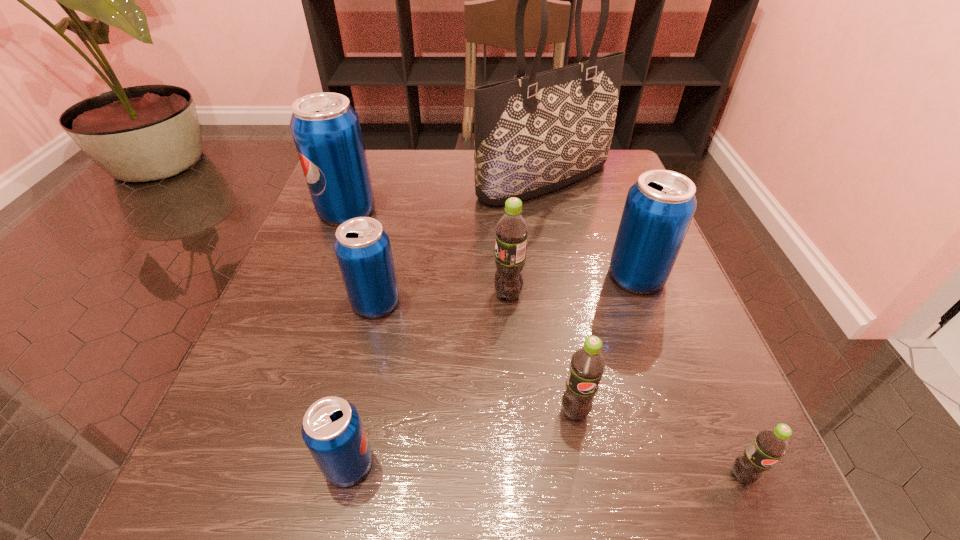
What are the coordinates of `tote bag` in the screenshot? It's located at (534, 134).

Locate an element on the screen. The height and width of the screenshot is (540, 960). black tote bag is located at coordinates (534, 134).

This screenshot has height=540, width=960. Find the location of `the leftmost object`. the leftmost object is located at coordinates (326, 130).

Find the location of a particular element. the biggest blue pop soda is located at coordinates (326, 130).

Where is `the second biggest blue pop soda`? the second biggest blue pop soda is located at coordinates (659, 207).

Image resolution: width=960 pixels, height=540 pixels. What are the coordinates of `the farthest green soda` in the screenshot? It's located at 512,231.

Where is `the leftmost green soda`? The width and height of the screenshot is (960, 540). the leftmost green soda is located at coordinates (512, 231).

At what (x,y) coordinates should I click in order to perform the action: click on the second smallest blue pop soda. Please return your answer as a coordinate pair (x, y). The width and height of the screenshot is (960, 540). Looking at the image, I should click on (362, 247).

Find the location of `the second farthest green soda`. the second farthest green soda is located at coordinates (587, 364).

I want to click on the second green soda from right to left, so click(587, 364).